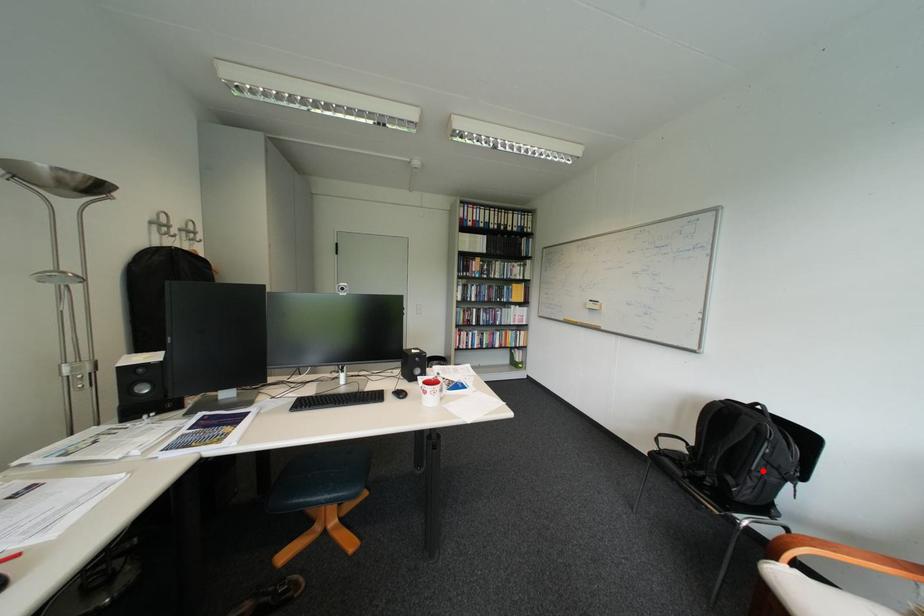
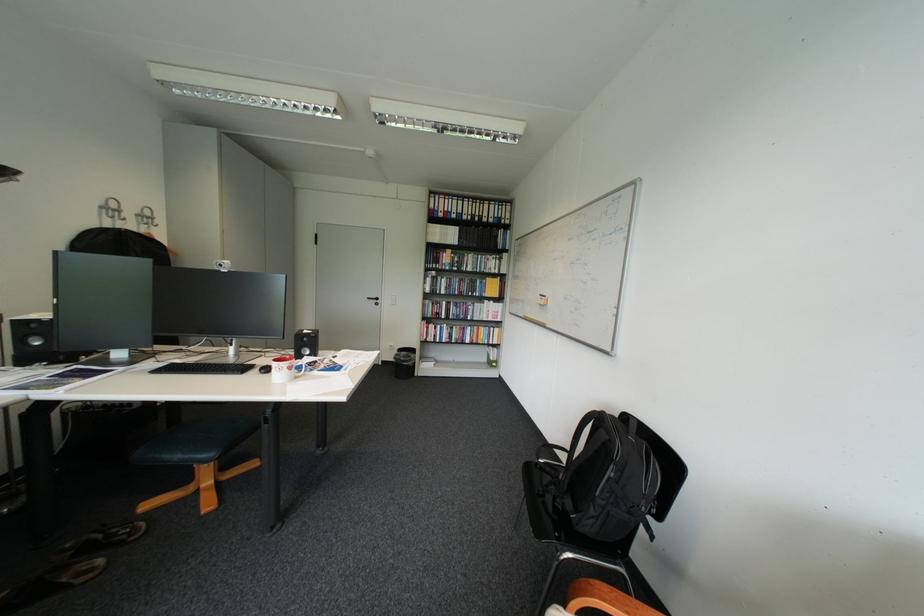
In the second image, find the point that corresponds to the highlighted location in the first image.

(608, 496)